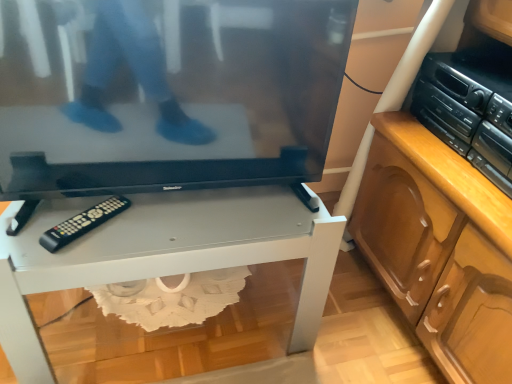
The height and width of the screenshot is (384, 512). Describe the element at coordinates (469, 109) in the screenshot. I see `black plastic stereo at right` at that location.

What is the approximate width of white glossy desk at center?

It is 19.49 inches.

The height and width of the screenshot is (384, 512). What do you see at coordinates (167, 94) in the screenshot? I see `black glossy television at center` at bounding box center [167, 94].

Measure the distance between point (111, 208) and camera.

The distance of point (111, 208) from camera is 38.15 inches.

Locate an element on the screen. The height and width of the screenshot is (384, 512). black plastic stereo at right is located at coordinates (469, 109).

Is white glossy desk at center with black glossy television at center?

There is a gap between white glossy desk at center and black glossy television at center.

Considering the relative positions of white glossy desk at center and black glossy television at center in the image provided, is white glossy desk at center in front of black glossy television at center?

No, the depth of white glossy desk at center is greater than that of black glossy television at center.

Is black glossy television at center surrounded by white glossy desk at center?

No, black glossy television at center is not inside white glossy desk at center.

Is point (93, 210) positioned in front of point (493, 137)?

That is True.

Considering the relative positions of black plastic remote at lower left and black plastic stereo at right in the image provided, is black plastic remote at lower left to the left of black plastic stereo at right from the viewer's perspective?

Yes, black plastic remote at lower left is to the left of black plastic stereo at right.

Could you tell me if black plastic remote at lower left is turned towards black plastic stereo at right?

No, black plastic remote at lower left is not turned towards black plastic stereo at right.

What's the angular difference between black plastic remote at lower left and black plastic stereo at right's facing directions?

39.2 degrees separate the facing orientations of black plastic remote at lower left and black plastic stereo at right.

Does white glossy desk at center have a larger size compared to black plastic remote at lower left?

Yes.

How much distance is there between white glossy desk at center and black plastic remote at lower left?

white glossy desk at center is 8.52 inches away from black plastic remote at lower left.

From the image's perspective, is white glossy desk at center under black plastic remote at lower left?

Yes.

Does white glossy desk at center touch black plastic remote at lower left?

white glossy desk at center is not next to black plastic remote at lower left, and they're not touching.

Is black plastic stereo at right not inside black plastic remote at lower left?

Absolutely, black plastic stereo at right is external to black plastic remote at lower left.

Can you confirm if black plastic stereo at right is taller than black plastic remote at lower left?

Indeed, black plastic stereo at right has a greater height compared to black plastic remote at lower left.

Is black plastic stereo at right oriented away from black plastic remote at lower left?

Answer: No, black plastic remote at lower left is not at the back of black plastic stereo at right.

Based on their positions, is black plastic remote at lower left located to the left or right of black glossy television at center?

Clearly, black plastic remote at lower left is on the left of black glossy television at center in the image.

In the image, is black plastic remote at lower left positioned in front of or behind black glossy television at center?

black plastic remote at lower left is positioned farther from the viewer than black glossy television at center.

Does black plastic remote at lower left have a larger size compared to black glossy television at center?

Incorrect, black plastic remote at lower left is not larger than black glossy television at center.

Is point (233, 4) behind point (210, 265)?

No, (233, 4) is closer to viewer.

Which object is closer to the camera, black glossy television at center or white glossy desk at center?

black glossy television at center.

You are a GUI agent. You are given a task and a screenshot of the screen. Output one action in this format:
    pyautogui.click(x=<x>, y=<y>)
    Task: Click on the television on the right of white glossy desk at center
    The width and height of the screenshot is (512, 384).
    Given the screenshot: What is the action you would take?
    pyautogui.click(x=167, y=94)

Which of these two, black glossy television at center or white glossy desk at center, is thinner?

With smaller width is black glossy television at center.

Which object is positioned more to the right, black plastic remote at lower left or white glossy desk at center?

From the viewer's perspective, white glossy desk at center appears more on the right side.

Is white glossy desk at center inside black plastic remote at lower left?

No, white glossy desk at center is not surrounded by black plastic remote at lower left.

At what (x,y) coordinates should I click in order to perform the action: click on control to the left of white glossy desk at center. Please return your answer as a coordinate pair (x, y). Looking at the image, I should click on (83, 223).

Consider the image. Are black plastic remote at lower left and white glossy desk at center located far from each other?

No.

This screenshot has width=512, height=384. I want to click on desk below the black glossy television at center (from the image's perspective), so tap(164, 254).

Locate an element on the screen. The height and width of the screenshot is (384, 512). stereo that is behind the black plastic remote at lower left is located at coordinates (469, 109).

In the scene shown: Looking at the image, which one is located further to white glossy desk at center, black plastic stereo at right or black glossy television at center?

Based on the image, black plastic stereo at right appears to be further to white glossy desk at center.

From the image, which object appears to be farther from black plastic stereo at right, black plastic remote at lower left or black glossy television at center?

black plastic remote at lower left.

Considering their positions, is white glossy desk at center positioned further to black plastic remote at lower left than black glossy television at center?

Among the two, black glossy television at center is located further to black plastic remote at lower left.

From the picture: From the image, which object appears to be nearer to white glossy desk at center, black plastic remote at lower left or black glossy television at center?

Among the two, black glossy television at center is located nearer to white glossy desk at center.

Based on the photo, from the image, which object appears to be farther from white glossy desk at center, black plastic remote at lower left or black plastic stereo at right?

black plastic stereo at right is further to white glossy desk at center.

Estimate the real-world distances between objects in this image. Which object is further from black plastic remote at lower left, white glossy desk at center or black plastic stereo at right?

black plastic stereo at right is positioned further to the anchor black plastic remote at lower left.

Looking at the image, which one is located further to black glossy television at center, white glossy desk at center or black plastic stereo at right?

black plastic stereo at right.

When comparing their distances from white glossy desk at center, does black glossy television at center or black plastic stereo at right seem closer?

Among the two, black glossy television at center is located nearer to white glossy desk at center.

Find the location of a particular element. television between white glossy desk at center and black plastic stereo at right from left to right is located at coordinates (167, 94).

Where is `desk located between black plastic remote at lower left and black plastic stereo at right in the left-right direction`? This screenshot has width=512, height=384. desk located between black plastic remote at lower left and black plastic stereo at right in the left-right direction is located at coordinates (164, 254).

This screenshot has width=512, height=384. Identify the location of television located between black plastic remote at lower left and black plastic stereo at right in the left-right direction. (167, 94).

What are the coordinates of `control between black glossy television at center and white glossy desk at center in the vertical direction` in the screenshot? It's located at (83, 223).